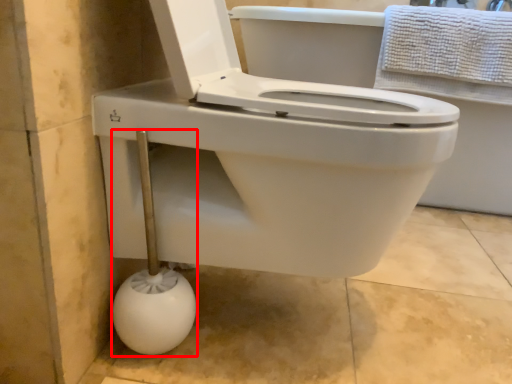
Question: From the image's perspective, considering the relative positions of shower (annotated by the red box) and towel in the image provided, where is shower (annotated by the red box) located with respect to the staircase?

Choices:
 (A) above
 (B) below

Answer: (B)